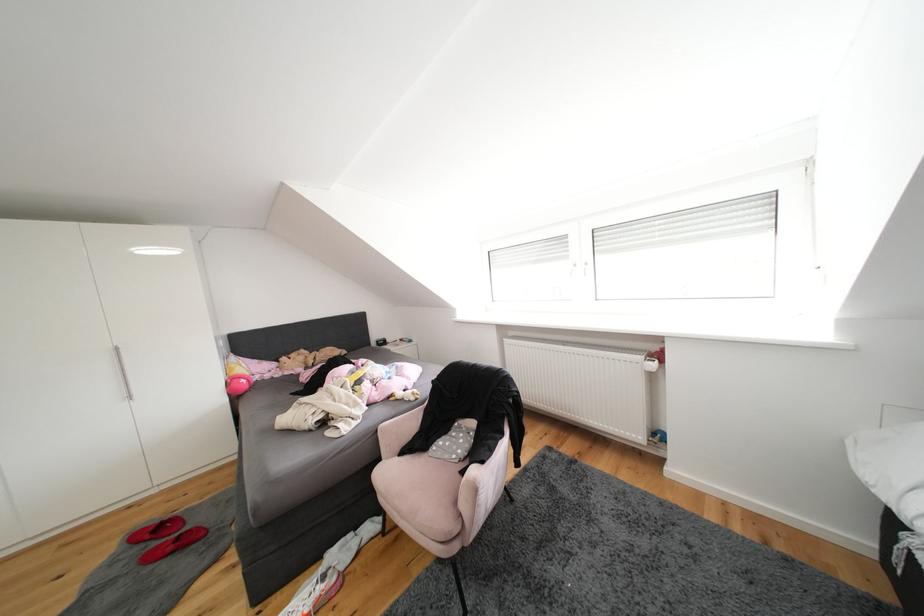
The width and height of the screenshot is (924, 616). Find the location of `chair sitting surface`. chair sitting surface is located at coordinates click(418, 480).